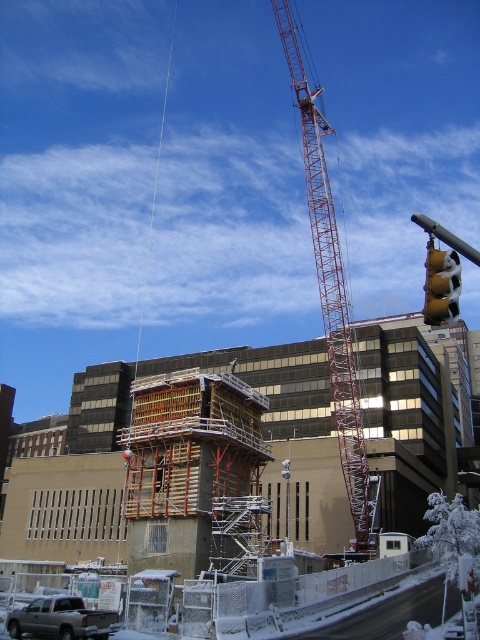
Is red metal crane at center further to the viewer compared to silver metallic truck at lower left?

Yes, it is.

Who is taller, red metal crane at center or silver metallic truck at lower left?

red metal crane at center is taller.

Locate an element on the screen. This screenshot has height=640, width=480. red metal crane at center is located at coordinates (330, 285).

Is point (55, 634) closer to viewer compared to point (453, 269)?

Yes.

Can you confirm if silver metallic truck at lower left is shorter than yellow matte traffic light at right?

Indeed, silver metallic truck at lower left has a lesser height compared to yellow matte traffic light at right.

Which is in front, point (19, 624) or point (457, 269)?

Point (19, 624)

The width and height of the screenshot is (480, 640). In order to click on silver metallic truck at lower left in this screenshot , I will do `click(60, 620)`.

Can you confirm if red metal crane at center is taller than yellow matte traffic light at right?

Indeed, red metal crane at center has a greater height compared to yellow matte traffic light at right.

Is red metal crane at center thinner than yellow matte traffic light at right?

In fact, red metal crane at center might be wider than yellow matte traffic light at right.

Who is more forward, (328, 301) or (437, 298)?

Point (437, 298) is in front.

Where is `red metal crane at center`? This screenshot has height=640, width=480. red metal crane at center is located at coordinates (330, 285).